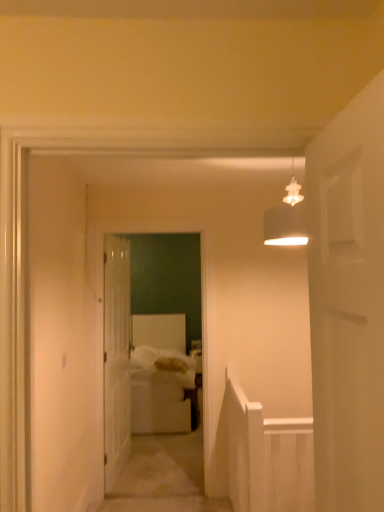
Question: Is white glossy door at center further to the viewer compared to white soft bed at center?

Choices:
 (A) yes
 (B) no

Answer: (B)

Question: Is white glossy door at center closer to the viewer compared to white soft bed at center?

Choices:
 (A) yes
 (B) no

Answer: (A)

Question: From a real-world perspective, is white glossy door at center beneath white soft bed at center?

Choices:
 (A) yes
 (B) no

Answer: (B)

Question: Would you say white glossy door at center contains white soft bed at center?

Choices:
 (A) yes
 (B) no

Answer: (B)

Question: Does white glossy door at center have a lesser height compared to white soft bed at center?

Choices:
 (A) yes
 (B) no

Answer: (B)

Question: From the image's perspective, is white glossy door at center beneath white soft bed at center?

Choices:
 (A) no
 (B) yes

Answer: (A)

Question: Is white glossy door at center in front of matte white lampshade at upper center?

Choices:
 (A) yes
 (B) no

Answer: (B)

Question: Is white glossy door at center not near matte white lampshade at upper center?

Choices:
 (A) no
 (B) yes

Answer: (B)

Question: Does white glossy door at center have a smaller size compared to matte white lampshade at upper center?

Choices:
 (A) no
 (B) yes

Answer: (A)

Question: From the image's perspective, does white glossy door at center appear higher than matte white lampshade at upper center?

Choices:
 (A) no
 (B) yes

Answer: (A)

Question: Does white glossy door at center have a greater height compared to matte white lampshade at upper center?

Choices:
 (A) no
 (B) yes

Answer: (B)

Question: From a real-world perspective, is white glossy door at center positioned under matte white lampshade at upper center based on gravity?

Choices:
 (A) no
 (B) yes

Answer: (B)

Question: Can you confirm if matte white lampshade at upper center is thinner than white glossy door at center?

Choices:
 (A) no
 (B) yes

Answer: (A)